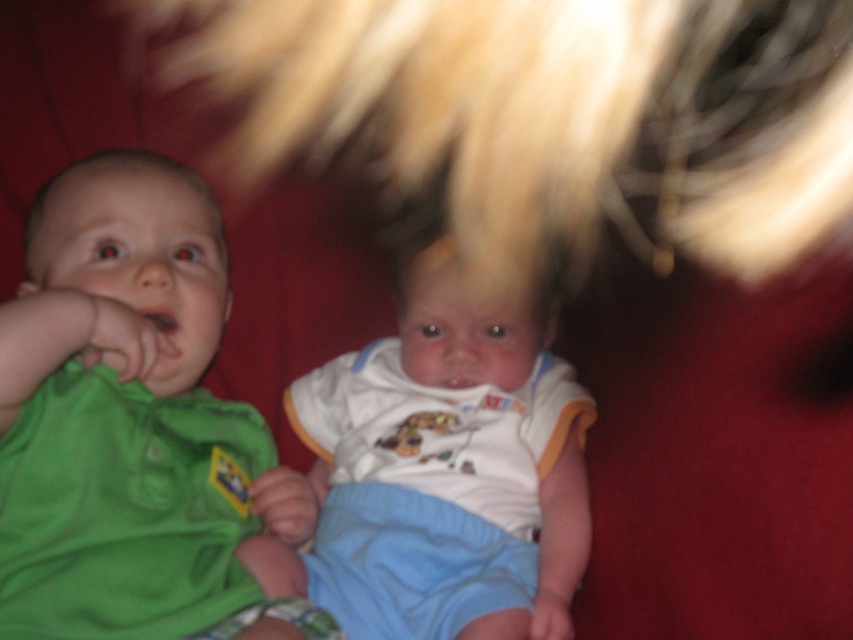
Question: Which point is farther from the camera taking this photo?

Choices:
 (A) (537, 552)
 (B) (45, 227)

Answer: (A)

Question: Is green fabric baby at left below white cotton onesie at center?

Choices:
 (A) no
 (B) yes

Answer: (A)

Question: Which object appears farthest from the camera in this image?

Choices:
 (A) green fabric baby at left
 (B) white cotton onesie at center

Answer: (B)

Question: Is the position of green fabric baby at left more distant than that of white cotton onesie at center?

Choices:
 (A) no
 (B) yes

Answer: (A)

Question: Is green fabric baby at left to the right of white cotton onesie at center from the viewer's perspective?

Choices:
 (A) yes
 (B) no

Answer: (B)

Question: Which point is farther from the camera taking this photo?

Choices:
 (A) click(65, 224)
 (B) click(410, 452)

Answer: (B)